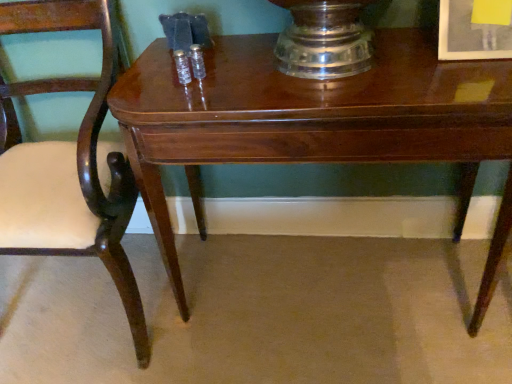
You are a GUI agent. You are given a task and a screenshot of the screen. Output one action in this format:
    pyautogui.click(x=<x>, y=<y>)
    Task: Click on the unoccupied area in front of matte white picture frame at upper right
    
    Given the screenshot: What is the action you would take?
    pyautogui.click(x=470, y=76)